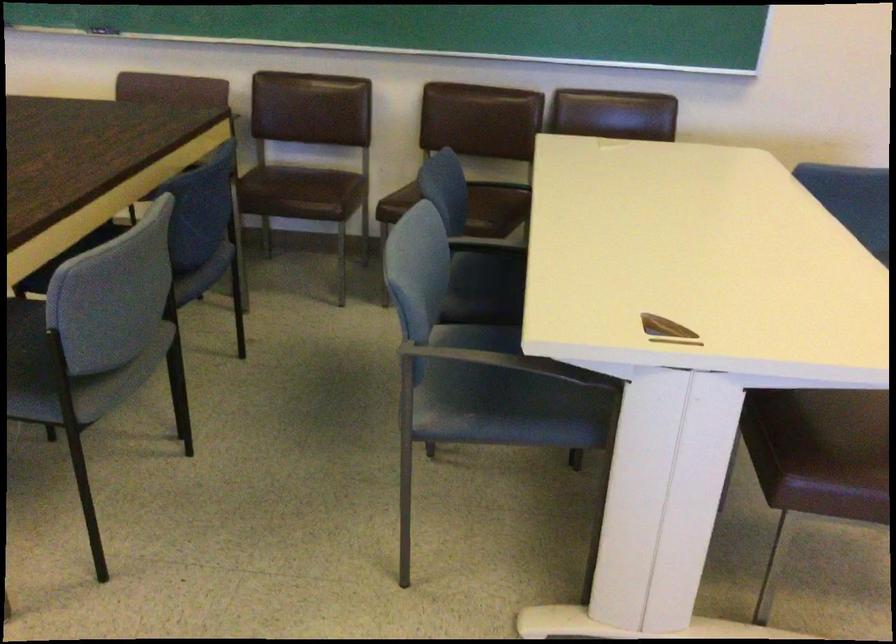
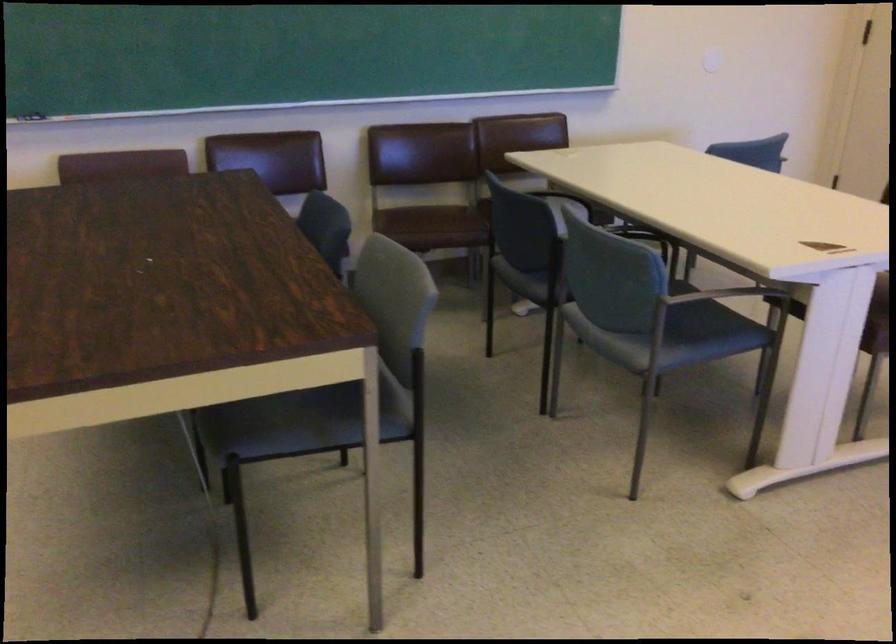
In the second image, find the point that corresponds to point (529, 401) in the first image.

(700, 330)